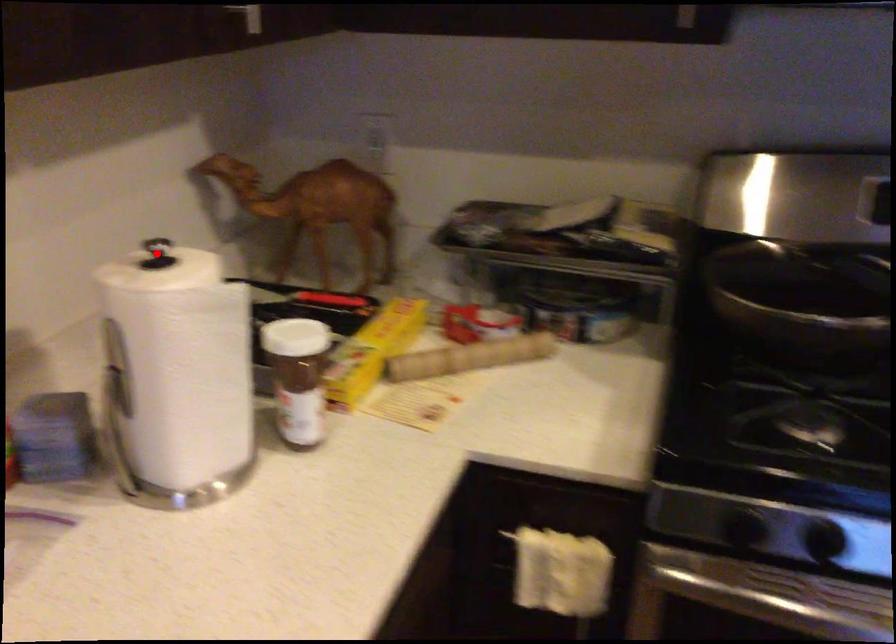
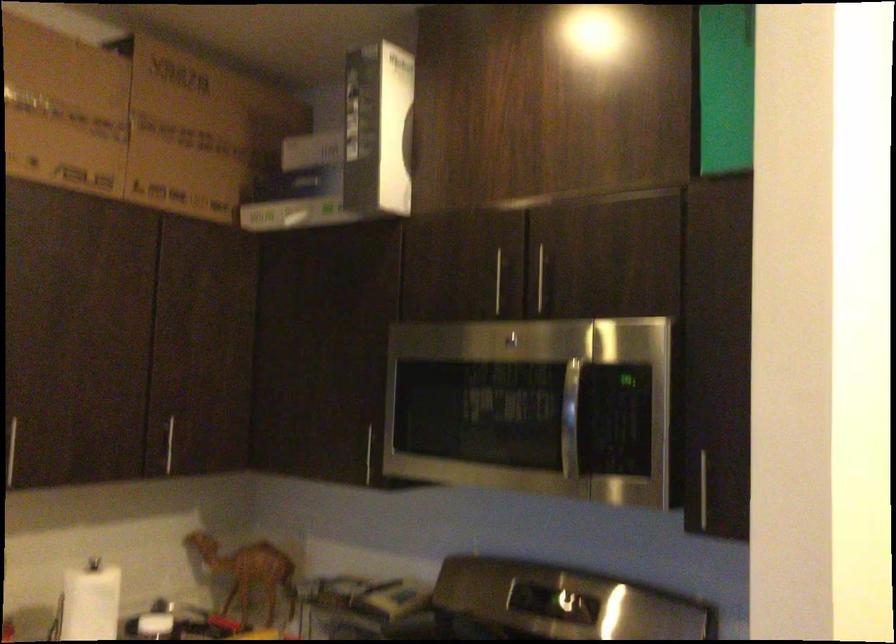
Question: I am providing you with two images of the same scene from different viewpoints. A red point is marked on the first image. Is the red point's position out of view in image 2?

Choices:
 (A) Yes
 (B) No

Answer: (A)